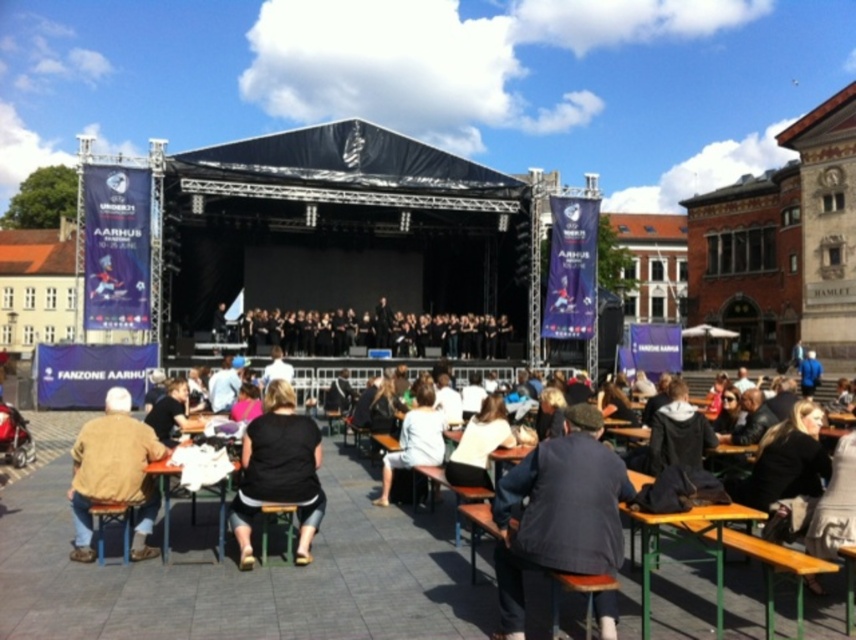
Question: Does brown leather jacket at lower left appear on the left side of orange wooden table at lower right?

Choices:
 (A) yes
 (B) no

Answer: (A)

Question: Does orange wooden table at lower right appear on the left side of wooden at center?

Choices:
 (A) no
 (B) yes

Answer: (B)

Question: Which object appears closest to the camera in this image?

Choices:
 (A) light beige cotton shirt at center
 (B) black fabric shirt at center

Answer: (B)

Question: Which point is farther from the camera taking this photo?

Choices:
 (A) (601, 417)
 (B) (851, 561)
 (C) (147, 504)

Answer: (C)

Question: Which point appears farthest from the camera in this image?

Choices:
 (A) (156, 438)
 (B) (164, 545)

Answer: (A)

Question: Is the position of orange wooden table at lower right more distant than that of wooden at center?

Choices:
 (A) no
 (B) yes

Answer: (B)